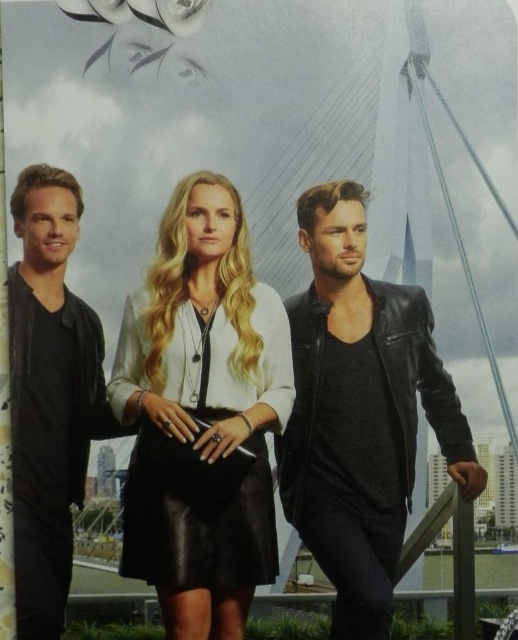
You are a photographer trying to capture the black leather skirt at center. Based on its 2D coordinates, where should you aim your camera?

The black leather skirt at center is located at the 2D coordinates point (202, 413), so aim your camera there to capture it.

You are a fashion designer observing the scene and want to create a new outfit that combines elements from both the black leather skirt at center and the matte black leather jacket at left. Which piece should you place on top to ensure proper layering?

The matte black leather jacket at left should be placed on top since the black leather skirt at center is positioned on its right side, indicating it is worn underneath.